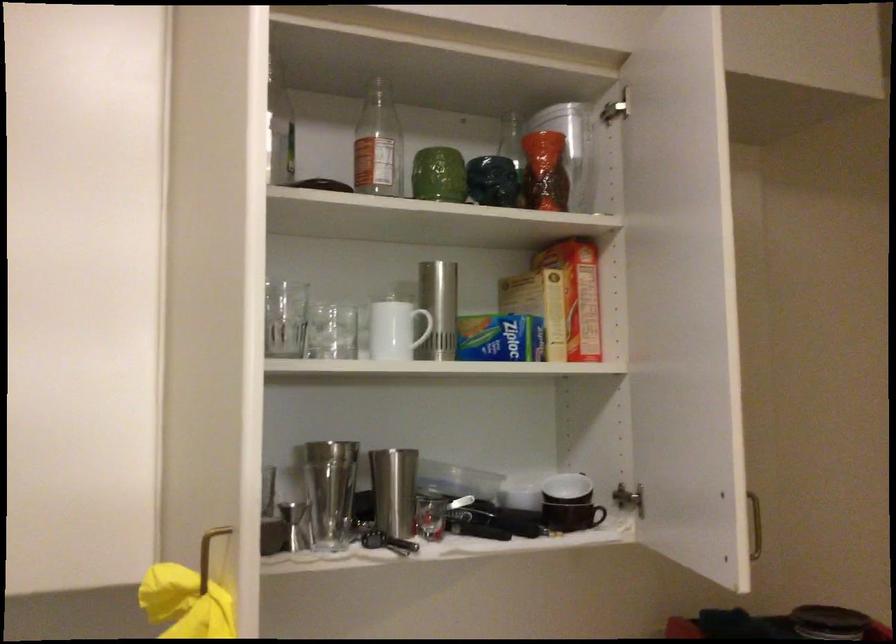
The location [393,489] corresponds to which object?

It refers to a silver cocktail shaker.